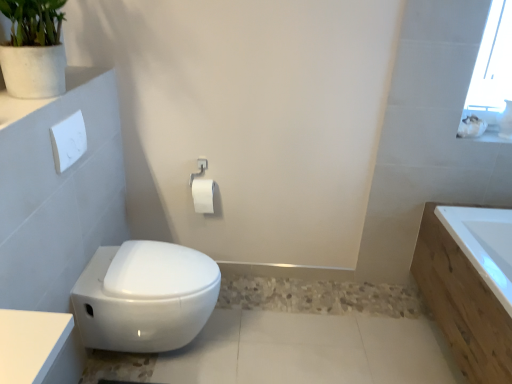
You are a GUI agent. You are given a task and a screenshot of the screen. Output one action in this format:
    pyautogui.click(x=<x>, y=<y>)
    Task: Click on the white matte toilet paper at center
    The height and width of the screenshot is (384, 512).
    Given the screenshot: What is the action you would take?
    tap(203, 195)

What is the approximate width of white matte toilet paper at center?

4.17 inches.

Find the location of a particular element. Image resolution: width=512 pixels, height=384 pixels. white wood bathtub at right is located at coordinates (462, 305).

Considering the sizes of objects white matte toilet paper at center and white glossy bidet at lower left in the image provided, who is bigger, white matte toilet paper at center or white glossy bidet at lower left?

With larger size is white glossy bidet at lower left.

Is white matte toilet paper at center thinner than white glossy bidet at lower left?

Yes.

Is white matte toilet paper at center to the left of white glossy bidet at lower left from the viewer's perspective?

No, white matte toilet paper at center is not to the left of white glossy bidet at lower left.

Considering their positions, is white matte toilet paper at center located in front of or behind white glossy bidet at lower left?

In the image, white matte toilet paper at center appears behind white glossy bidet at lower left.

Would you say white wood bathtub at right is to the left or to the right of white matte toilet paper at center in the picture?

From the image, it's evident that white wood bathtub at right is to the right of white matte toilet paper at center.

Is white wood bathtub at right facing away from white matte toilet paper at center?

No, white matte toilet paper at center is not at the back of white wood bathtub at right.

Image resolution: width=512 pixels, height=384 pixels. What are the coordinates of `bath on the right of white matte toilet paper at center` in the screenshot? It's located at click(462, 305).

Is white wood bathtub at right bigger or smaller than white matte toilet paper at center?

In the image, white wood bathtub at right appears to be larger than white matte toilet paper at center.

Relative to white glossy ledge at upper left, is white wood bathtub at right in front or behind?

Clearly, white wood bathtub at right is behind white glossy ledge at upper left.

From the image's perspective, is white wood bathtub at right located beneath white glossy ledge at upper left?

Indeed, from the image's perspective, white wood bathtub at right is shown beneath white glossy ledge at upper left.

Identify the location of bath below the white glossy ledge at upper left (from a real-world perspective). pyautogui.click(x=462, y=305).

Is there a large distance between white wood bathtub at right and white glossy ledge at upper left?

Yes, white wood bathtub at right and white glossy ledge at upper left are quite far apart.

Does white glossy ledge at upper left have a greater height compared to white matte toilet paper at center?

No, white glossy ledge at upper left is not taller than white matte toilet paper at center.

From a real-world perspective, is white glossy ledge at upper left physically located above or below white matte toilet paper at center?

From a real-world perspective, white glossy ledge at upper left is physically above white matte toilet paper at center.

Does white glossy ledge at upper left lie in front of white matte toilet paper at center?

That is True.

Would you consider white glossy ledge at upper left to be distant from white matte toilet paper at center?

Actually, white glossy ledge at upper left and white matte toilet paper at center are a little close together.

Can you tell me how much white glossy bidet at lower left and white wood bathtub at right differ in facing direction?

white glossy bidet at lower left and white wood bathtub at right are facing 180 degrees away from each other.

Does white glossy bidet at lower left have a lesser width compared to white wood bathtub at right?

Yes.

Image resolution: width=512 pixels, height=384 pixels. Identify the location of bidet behind the white wood bathtub at right. (145, 296).

Is white glossy bidet at lower left next to white wood bathtub at right and touching it?

No, white glossy bidet at lower left is not making contact with white wood bathtub at right.

How different are the orientations of white glossy ledge at upper left and white wood bathtub at right in degrees?

The facing directions of white glossy ledge at upper left and white wood bathtub at right are 180 degrees apart.

From the image's perspective, which one is positioned higher, white glossy ledge at upper left or white wood bathtub at right?

From the image's view, white glossy ledge at upper left is above.

From a real-world perspective, who is located higher, white glossy ledge at upper left or white wood bathtub at right?

white glossy ledge at upper left is physically above.

Which is correct: white glossy ledge at upper left is inside white wood bathtub at right, or outside of it?

The correct answer is: outside.

In the image, is white matte toilet paper at center on the left side or the right side of white wood bathtub at right?

In the image, white matte toilet paper at center appears on the left side of white wood bathtub at right.

Is white matte toilet paper at center in front of or behind white wood bathtub at right in the image?

Visually, white matte toilet paper at center is located behind white wood bathtub at right.

Considering the sizes of white matte toilet paper at center and white wood bathtub at right in the image, is white matte toilet paper at center wider or thinner than white wood bathtub at right?

In the image, white matte toilet paper at center appears to be more narrow than white wood bathtub at right.

Is point (193, 184) closer to camera compared to point (468, 281)?

No.

This screenshot has height=384, width=512. I want to click on toilet paper on the right of white glossy bidet at lower left, so click(x=203, y=195).

Find the location of a particular element. bath in front of the white matte toilet paper at center is located at coordinates (462, 305).

From the image, which object appears to be farther from white glossy bidet at lower left, white glossy ledge at upper left or white matte toilet paper at center?

Among the two, white glossy ledge at upper left is located further to white glossy bidet at lower left.

Estimate the real-world distances between objects in this image. Which object is closer to white matte toilet paper at center, white glossy bidet at lower left or white wood bathtub at right?

white glossy bidet at lower left is closer to white matte toilet paper at center.

Based on their spatial positions, is white matte toilet paper at center or white glossy ledge at upper left further from white wood bathtub at right?

Among the two, white glossy ledge at upper left is located further to white wood bathtub at right.

From the image, which object appears to be farther from white matte toilet paper at center, white wood bathtub at right or white glossy bidet at lower left?

white wood bathtub at right lies further to white matte toilet paper at center than the other object.

Consider the image. Which object lies further to the anchor point white glossy ledge at upper left, white glossy bidet at lower left or white wood bathtub at right?

white wood bathtub at right.

Which object lies nearer to the anchor point white matte toilet paper at center, white wood bathtub at right or white glossy ledge at upper left?

Among the two, white glossy ledge at upper left is located nearer to white matte toilet paper at center.

Looking at the image, which one is located closer to white glossy bidet at lower left, white wood bathtub at right or white matte toilet paper at center?

white matte toilet paper at center is closer to white glossy bidet at lower left.

Which object lies further to the anchor point white wood bathtub at right, white glossy bidet at lower left or white glossy ledge at upper left?

Based on the image, white glossy ledge at upper left appears to be further to white wood bathtub at right.

What are the coordinates of `toilet paper located between white glossy bidet at lower left and white wood bathtub at right in the left-right direction` in the screenshot? It's located at (203, 195).

At what (x,y) coordinates should I click in order to perform the action: click on toilet paper located between white glossy ledge at upper left and white wood bathtub at right in the left-right direction. Please return your answer as a coordinate pair (x, y). This screenshot has width=512, height=384. Looking at the image, I should click on (203, 195).

Identify the location of bidet between white glossy ledge at upper left and white matte toilet paper at center from front to back. (145, 296).

Find the location of a particular element. The height and width of the screenshot is (384, 512). bidet situated between white glossy ledge at upper left and white wood bathtub at right from left to right is located at coordinates (145, 296).